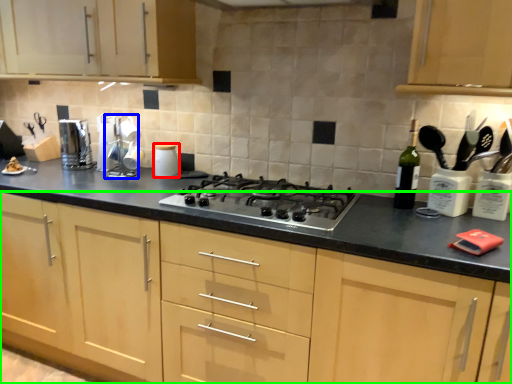
Question: Considering the real-world distances, which object is closest to kitchen appliance (highlighted by a red box)? appliance (highlighted by a blue box) or cabinetry (highlighted by a green box).

Choices:
 (A) appliance
 (B) cabinetry

Answer: (A)